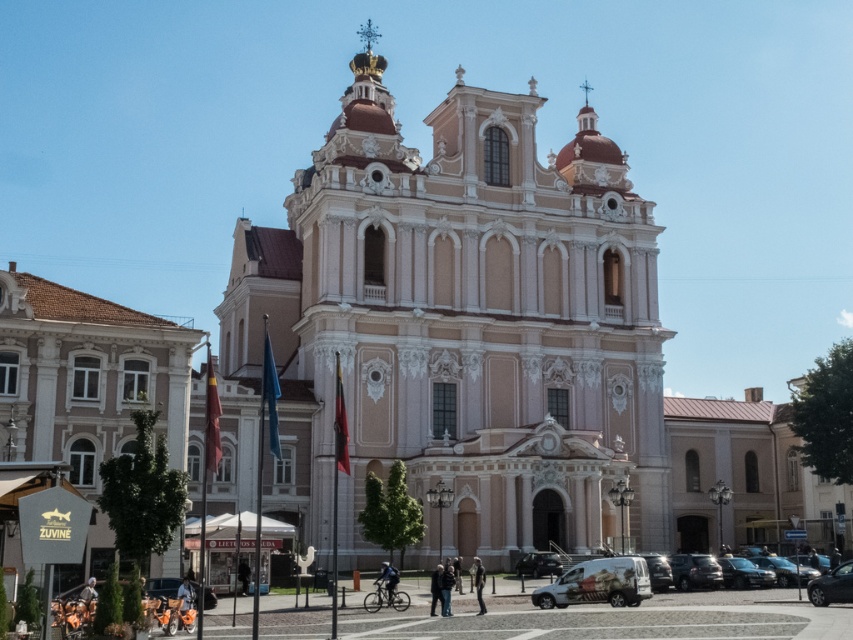
Between metallic silver car at lower right and black glossy car at lower right, which one has more height?

Standing taller between the two is black glossy car at lower right.

Does metallic silver car at lower right have a greater width compared to black glossy car at lower right?

In fact, metallic silver car at lower right might be narrower than black glossy car at lower right.

Measure the distance between metallic silver car at lower right and camera.

A distance of 212.98 feet exists between metallic silver car at lower right and camera.

Where is `metallic silver car at lower right`? This screenshot has width=853, height=640. metallic silver car at lower right is located at coordinates (694, 572).

Is metallic silver car at lower right thinner than shiny black car at lower right?

Yes.

Between metallic silver car at lower right and shiny black car at lower right, which one has more height?

shiny black car at lower right is taller.

Between point (695, 582) and point (848, 573), which one is positioned in front?

Point (848, 573) is in front.

Where is `metallic silver car at lower right`? metallic silver car at lower right is located at coordinates (694, 572).

Measure the distance between white matte van at lower center and shiny black car at lower right.

32.42 feet

Who is more forward, (602, 584) or (831, 592)?

Point (831, 592) is in front.

What are the coordinates of `white matte van at lower center` in the screenshot? It's located at tap(598, 582).